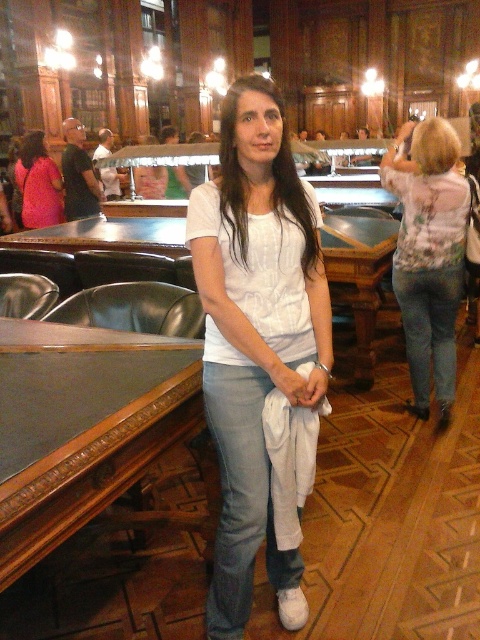
Does white cotton t-shirt at center have a smaller size compared to matte pink blouse at center?

Yes.

Can you confirm if white cotton t-shirt at center is wider than matte pink blouse at center?

No.

Which is in front, point (257, 230) or point (31, 138)?

Point (257, 230) is more forward.

Identify the location of white cotton t-shirt at center. (255, 336).

How distant is floral print blouse at center from matte pink blouse at center?

11.36 feet

Does floral print blouse at center appear over matte pink blouse at center?

No.

Where is `floral print blouse at center`? Image resolution: width=480 pixels, height=640 pixels. floral print blouse at center is located at coordinates (429, 253).

Does point (243, 566) come in front of point (406, 291)?

That is True.

In order to click on white cotton t-shirt at center in this screenshot , I will do `click(255, 336)`.

Image resolution: width=480 pixels, height=640 pixels. What do you see at coordinates (255, 336) in the screenshot? I see `white cotton t-shirt at center` at bounding box center [255, 336].

Identify the location of white cotton t-shirt at center. This screenshot has height=640, width=480. (255, 336).